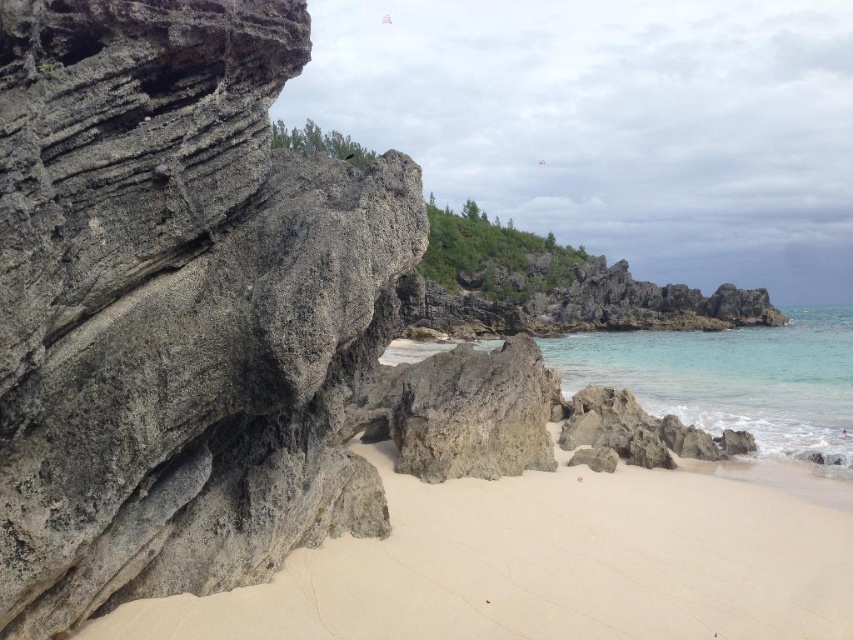
Is gray rough rock at left above clear water at beach center?

Yes.

Locate an element on the screen. Image resolution: width=853 pixels, height=640 pixels. gray rough rock at left is located at coordinates (177, 305).

Between gray rough rock at left and gray rough rock at center, which one has less height?

With less height is gray rough rock at center.

Does gray rough rock at left have a lesser width compared to gray rough rock at center?

Yes, gray rough rock at left is thinner than gray rough rock at center.

Is point (184, 188) closer to camera compared to point (526, 360)?

Yes, point (184, 188) is in front of point (526, 360).

Locate an element on the screen. Image resolution: width=853 pixels, height=640 pixels. gray rough rock at left is located at coordinates click(x=177, y=305).

This screenshot has height=640, width=853. Describe the element at coordinates (733, 380) in the screenshot. I see `clear water at beach center` at that location.

Does point (424, 342) lie behind point (465, 428)?

Yes.

Find the location of a particular element. This screenshot has width=853, height=640. clear water at beach center is located at coordinates (733, 380).